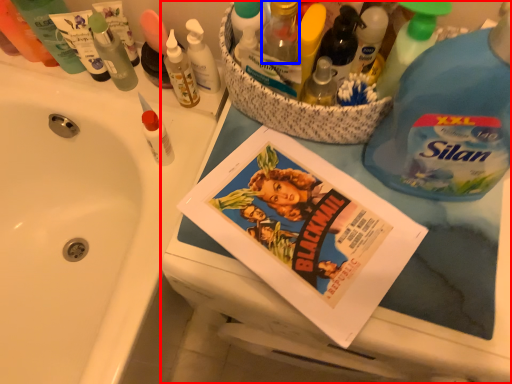
Question: Which object appears closest to the camera in this image, bathroom cabinet (highlighted by a red box) or toiletry (highlighted by a blue box)?

Choices:
 (A) bathroom cabinet
 (B) toiletry

Answer: (A)